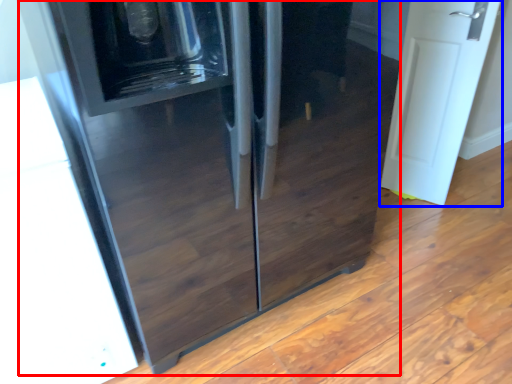
Question: Which object is further to the camera taking this photo, refrigerator (highlighted by a red box) or door (highlighted by a blue box)?

Choices:
 (A) refrigerator
 (B) door

Answer: (B)